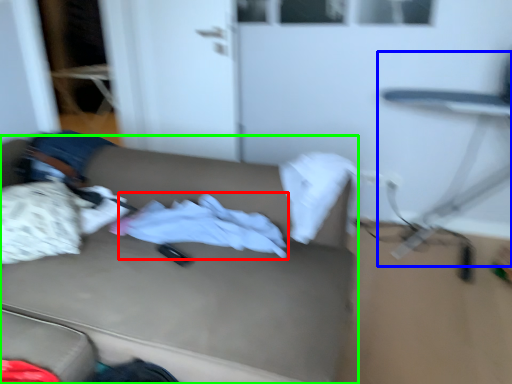
Question: Estimate the real-world distances between objects in this image. Which object is farther from baby clothe (highlighted by a red box), swivel chair (highlighted by a blue box) or studio couch (highlighted by a green box)?

Choices:
 (A) swivel chair
 (B) studio couch

Answer: (A)